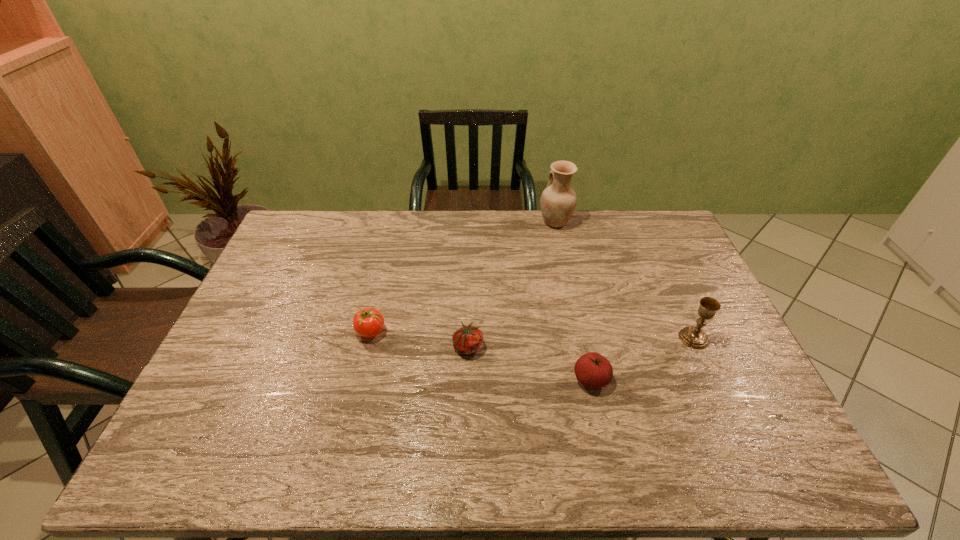
Image resolution: width=960 pixels, height=540 pixels. Find the location of `vacant region at the near right corner`. vacant region at the near right corner is located at coordinates (744, 438).

This screenshot has height=540, width=960. Find the location of `vacant point located between the rightmost tomato and the farthest object`. vacant point located between the rightmost tomato and the farthest object is located at coordinates (573, 301).

Where is `vacant space in between the rightmost tomato and the leftmost object`? vacant space in between the rightmost tomato and the leftmost object is located at coordinates (481, 355).

Where is `vacant space that's between the tallest object and the nearest object`? vacant space that's between the tallest object and the nearest object is located at coordinates (573, 301).

At what (x,y) coordinates should I click in order to perform the action: click on empty location between the leftmost object and the shortest tomato. Please return your answer as a coordinate pair (x, y). The width and height of the screenshot is (960, 540). Looking at the image, I should click on (420, 339).

Locate an element on the screen. The height and width of the screenshot is (540, 960). free space between the nearest object and the pottery is located at coordinates (573, 301).

The height and width of the screenshot is (540, 960). I want to click on free spot between the leftmost tomato and the pottery, so click(463, 277).

The image size is (960, 540). Identify the location of free space that is in between the leftmost object and the rightmost object. (532, 335).

Where is `vacant space in between the nearest object and the fourth object from right to left`? Image resolution: width=960 pixels, height=540 pixels. vacant space in between the nearest object and the fourth object from right to left is located at coordinates (530, 362).

The height and width of the screenshot is (540, 960). I want to click on free area in between the second tallest object and the leftmost tomato, so click(532, 335).